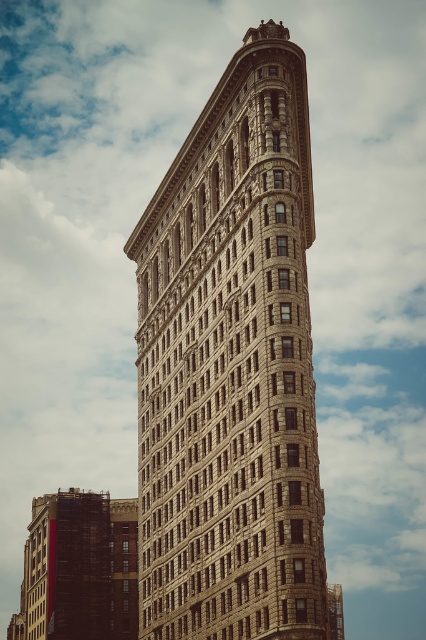
You are standing at the center of the park in front of the brown stone building at center. If you walk straight ahead, will you reach the building before reaching the park entrance?

The position of brown stone building at center is at point (232, 369), so you will reach the building before the park entrance.

You are a photographer planning to capture the brown stone building at center and the gold textured clock at center in a single frame. Based on their widths, which object should you position closer to the center of your camera frame to ensure both fit without cropping?

The brown stone building at center is wider than the gold textured clock at center. To ensure both fit in the frame without cropping, position the brown stone building at center closer to the center of your camera frame so that there is enough space for the wider object.